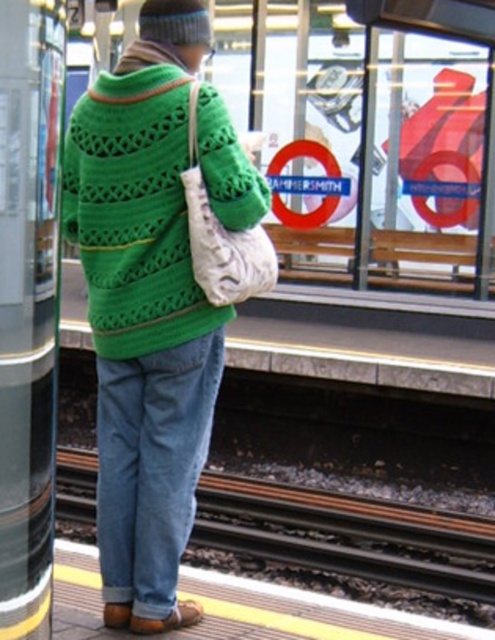
Question: Which of the following is the closest to the observer?

Choices:
 (A) (136, 456)
 (B) (224, 131)

Answer: (B)

Question: Does green knitted cardigan at center come in front of denim at center?

Choices:
 (A) yes
 (B) no

Answer: (A)

Question: Which point is farther to the camera?

Choices:
 (A) (125, 593)
 (B) (136, 529)

Answer: (A)

Question: Is green knitted sweater at center below metal train track at lower center?

Choices:
 (A) yes
 (B) no

Answer: (B)

Question: Which point is farther from the camera taking this photo?

Choices:
 (A) (127, 440)
 (B) (237, 196)
 (C) (233, 520)
 (D) (264, 211)

Answer: (C)

Question: Is green knitted cardigan at center further to camera compared to denim at center?

Choices:
 (A) no
 (B) yes

Answer: (A)